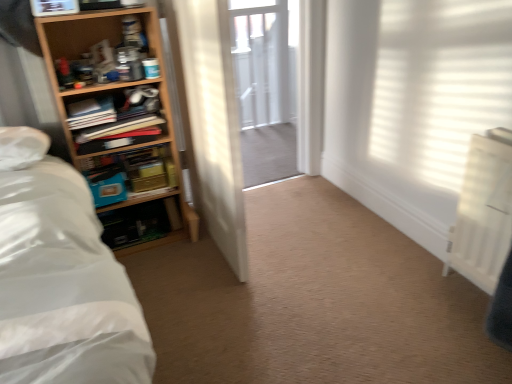
Question: Is wooden bookshelf at left, positioned as the 1th shelf in bottom-to-top order, taller than clear glass screen door at center?

Choices:
 (A) no
 (B) yes

Answer: (A)

Question: Does wooden bookshelf at left, positioned as the third shelf in top-to-bottom order, have a greater width compared to clear glass screen door at center?

Choices:
 (A) no
 (B) yes

Answer: (A)

Question: Is clear glass screen door at center completely or partially inside wooden bookshelf at left, positioned as the third shelf in top-to-bottom order?

Choices:
 (A) no
 (B) yes

Answer: (A)

Question: Could you tell me if wooden bookshelf at left, positioned as the third shelf in top-to-bottom order, is facing clear glass screen door at center?

Choices:
 (A) yes
 (B) no

Answer: (B)

Question: Is there a large distance between wooden bookshelf at left, positioned as the third shelf in top-to-bottom order, and clear glass screen door at center?

Choices:
 (A) yes
 (B) no

Answer: (A)

Question: From a real-world perspective, is clear glass screen door at center physically located above or below wooden bookshelf at left, the 3th shelf in the bottom-to-top sequence?

Choices:
 (A) below
 (B) above

Answer: (A)

Question: In terms of size, does clear glass screen door at center appear bigger or smaller than wooden bookshelf at left, which is the 1th shelf from top to bottom?

Choices:
 (A) small
 (B) big

Answer: (B)

Question: In terms of width, does clear glass screen door at center look wider or thinner when compared to wooden bookshelf at left, the 3th shelf in the bottom-to-top sequence?

Choices:
 (A) thin
 (B) wide

Answer: (A)

Question: Considering the positions of clear glass screen door at center and wooden bookshelf at left, which is the 1th shelf from top to bottom, in the image, is clear glass screen door at center taller or shorter than wooden bookshelf at left, which is the 1th shelf from top to bottom,?

Choices:
 (A) short
 (B) tall

Answer: (B)

Question: Is clear glass screen door at center in front of or behind wooden bookshelf at left, positioned as the third shelf in top-to-bottom order, in the image?

Choices:
 (A) behind
 (B) front

Answer: (A)

Question: Based on their positions, is clear glass screen door at center located to the left or right of wooden bookshelf at left, positioned as the 1th shelf in bottom-to-top order?

Choices:
 (A) right
 (B) left

Answer: (A)

Question: Is clear glass screen door at center inside or outside of wooden bookshelf at left, positioned as the 1th shelf in bottom-to-top order?

Choices:
 (A) inside
 (B) outside

Answer: (B)

Question: Does point (268, 69) appear closer or farther from the camera than point (160, 185)?

Choices:
 (A) farther
 (B) closer

Answer: (A)

Question: Does point (103, 157) appear closer or farther from the camera than point (77, 140)?

Choices:
 (A) farther
 (B) closer

Answer: (A)

Question: From a real-world perspective, is wooden bookshelf at left, positioned as the 1th shelf in bottom-to-top order, above or below wooden bookshelf at left, which is the 1th shelf from top to bottom?

Choices:
 (A) above
 (B) below

Answer: (B)